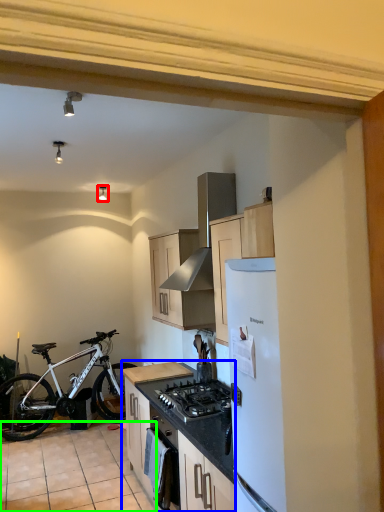
Question: Considering the real-world distances, which object is farthest from light fixture (highlighted by a red box)? cabinetry (highlighted by a blue box) or tile (highlighted by a green box)?

Choices:
 (A) cabinetry
 (B) tile

Answer: (A)